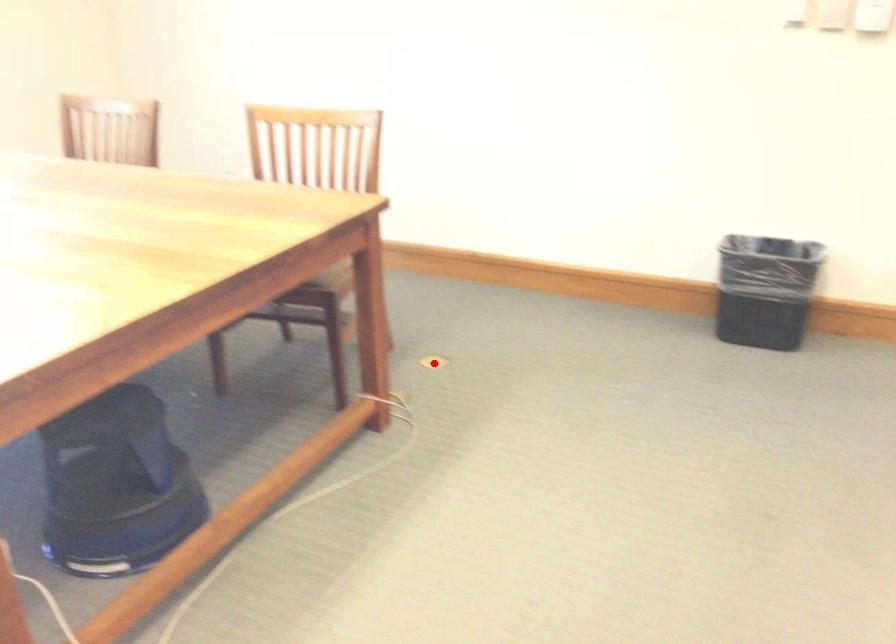
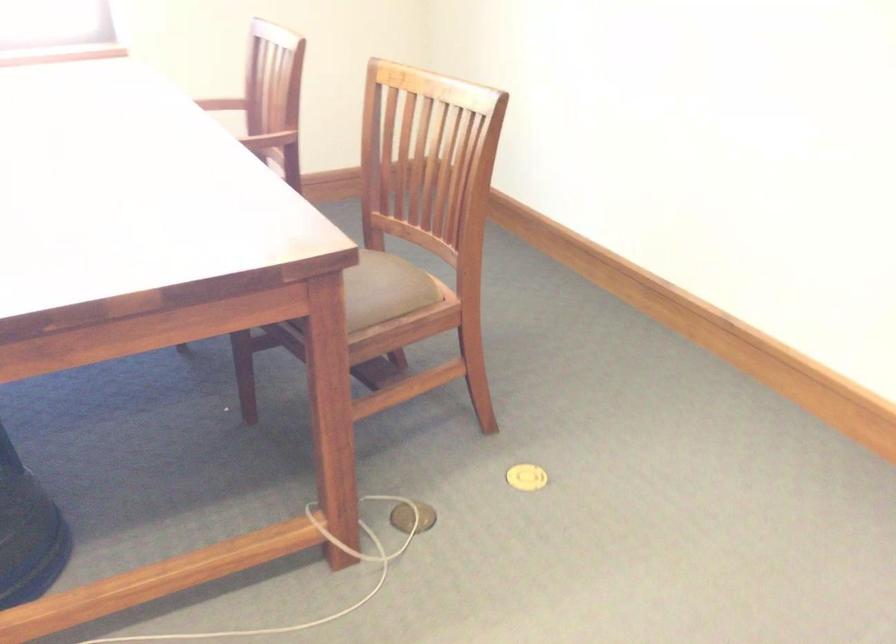
Where in the second image is the point corresponding to the highlighted location from the first image?

(526, 477)